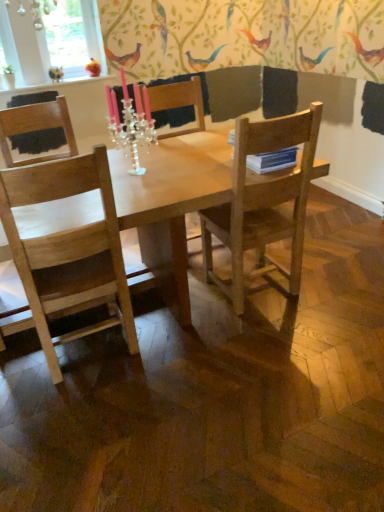
This screenshot has height=512, width=384. I want to click on vacant space underneath crystal clear candle holder at center (from a real-world perspective), so click(135, 174).